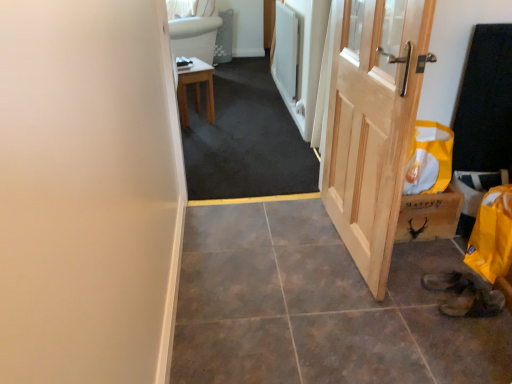
Question: Is natural wood door at right placed right next to wooden stool at center?

Choices:
 (A) no
 (B) yes

Answer: (A)

Question: Is natural wood door at right located outside wooden stool at center?

Choices:
 (A) yes
 (B) no

Answer: (A)

Question: Is natural wood door at right at the left side of wooden stool at center?

Choices:
 (A) yes
 (B) no

Answer: (B)

Question: Is natural wood door at right at the right side of wooden stool at center?

Choices:
 (A) no
 (B) yes

Answer: (B)

Question: Can you confirm if natural wood door at right is shorter than wooden stool at center?

Choices:
 (A) no
 (B) yes

Answer: (A)

Question: Is point (487, 292) positioned closer to the camera than point (233, 185)?

Choices:
 (A) closer
 (B) farther

Answer: (A)

Question: From a real-world perspective, is brown leather shoe at lower right positioned above or below dark gray carpet at center?

Choices:
 (A) above
 (B) below

Answer: (B)

Question: Is brown leather shoe at lower right inside the boundaries of dark gray carpet at center, or outside?

Choices:
 (A) inside
 (B) outside

Answer: (B)

Question: Looking at the image, does brown leather shoe at lower right seem bigger or smaller compared to dark gray carpet at center?

Choices:
 (A) big
 (B) small

Answer: (B)

Question: In the image, is white fabric curtain at upper center positioned in front of or behind brown leather shoe at lower right?

Choices:
 (A) behind
 (B) front

Answer: (A)

Question: Is white fabric curtain at upper center inside the boundaries of brown leather shoe at lower right, or outside?

Choices:
 (A) inside
 (B) outside

Answer: (B)

Question: From a real-world perspective, relative to brown leather shoe at lower right, is white fabric curtain at upper center vertically above or below?

Choices:
 (A) above
 (B) below

Answer: (A)

Question: Is point (184, 8) positioned closer to the camera than point (473, 286)?

Choices:
 (A) farther
 (B) closer

Answer: (A)

Question: Based on their positions, is dark gray carpet at center located to the left or right of white fabric curtain at upper center?

Choices:
 (A) left
 (B) right

Answer: (B)

Question: In terms of width, does dark gray carpet at center look wider or thinner when compared to white fabric curtain at upper center?

Choices:
 (A) thin
 (B) wide

Answer: (B)